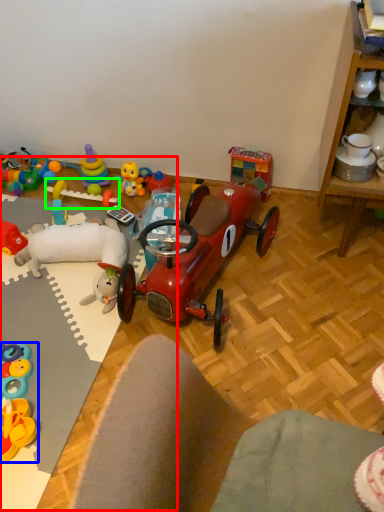
Question: Which object is the farthest from table (highlighted by a red box)? Choose among these: toy (highlighted by a blue box) or toy (highlighted by a green box).

Choices:
 (A) toy
 (B) toy

Answer: (B)